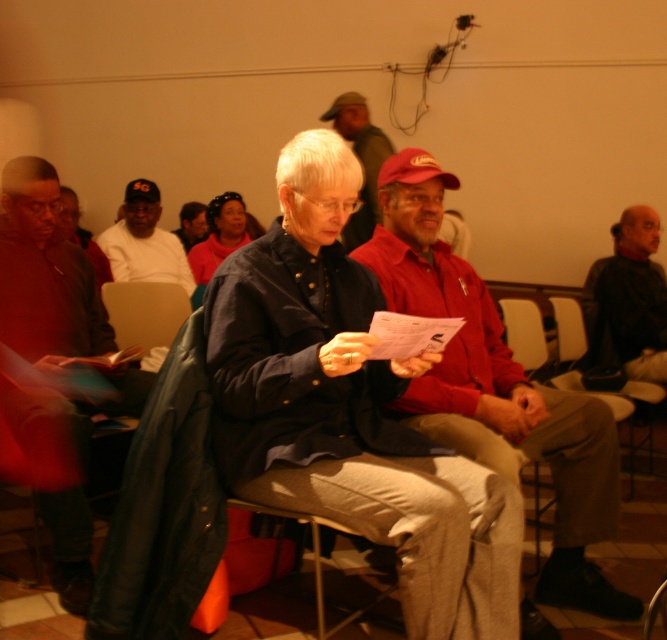
Who is more forward, [69,275] or [89,236]?

Point [69,275]

Measure the distance between dark brown leather jacket at left and camera.

The distance of dark brown leather jacket at left from camera is 2.11 meters.

Find the location of a particular element. This screenshot has height=640, width=667. dark brown leather jacket at left is located at coordinates (55, 292).

Describe the element at coordinates (55, 292) in the screenshot. I see `dark brown leather jacket at left` at that location.

Can you confirm if dark brown leather jacket at left is positioned above black leather jacket at right?

No, dark brown leather jacket at left is not above black leather jacket at right.

Between point (71, 508) and point (614, 337), which one is positioned behind?

The point (614, 337) is behind.

Identify the location of dark brown leather jacket at left. The width and height of the screenshot is (667, 640). pos(55,292).

Which is behind, point (7, 177) or point (149, 305)?

The point (149, 305) is behind.

Is dark brown leather jacket at left shorter than smooth leather chair at center?

No.

Image resolution: width=667 pixels, height=640 pixels. In order to click on dark brown leather jacket at left in this screenshot , I will do `click(55, 292)`.

Find the location of `dark brown leather jacket at left`. dark brown leather jacket at left is located at coordinates (55, 292).